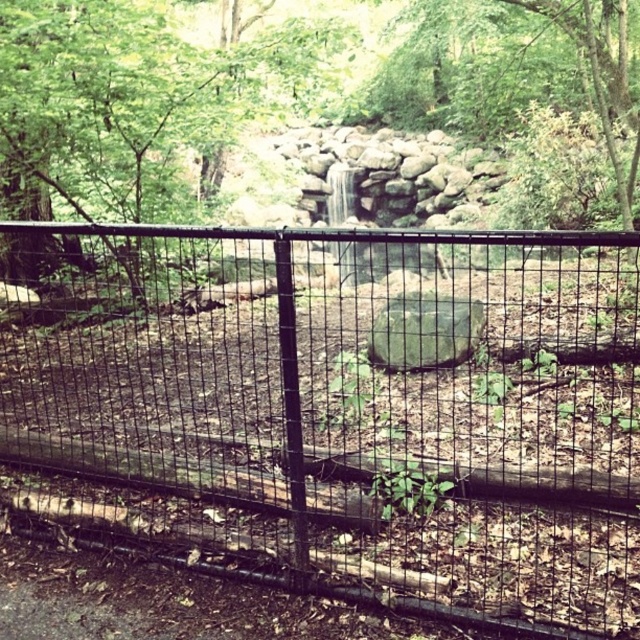
Consider the image. You are standing in a forest and see the green leafy tree at center and the green mossy rock at center. Which object is positioned to the left when facing the scene?

The green leafy tree at center is positioned to the left of the green mossy rock at center.

You are standing in a forest and see the green leafy tree at upper center and the green mossy rock at center. Which object is located to the right of the other?

The green leafy tree at upper center is positioned on the right side of green mossy rock at center.

From the picture: You are standing in a forest near a waterfall and see two points marked in the scene. The first point is at coordinates point (180,68) and the second is at point (369,349). Which point is closer to you?

Point (180,68) is further to the viewer than point (369,349), so the second point is closer to you.